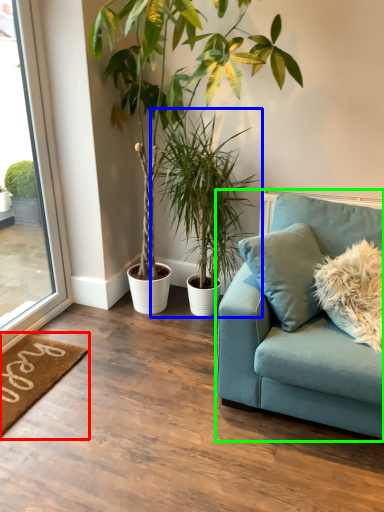
Question: Which is farther away from doormat (highlighted by a red box)? houseplant (highlighted by a blue box) or studio couch (highlighted by a green box)?

Choices:
 (A) houseplant
 (B) studio couch

Answer: (A)